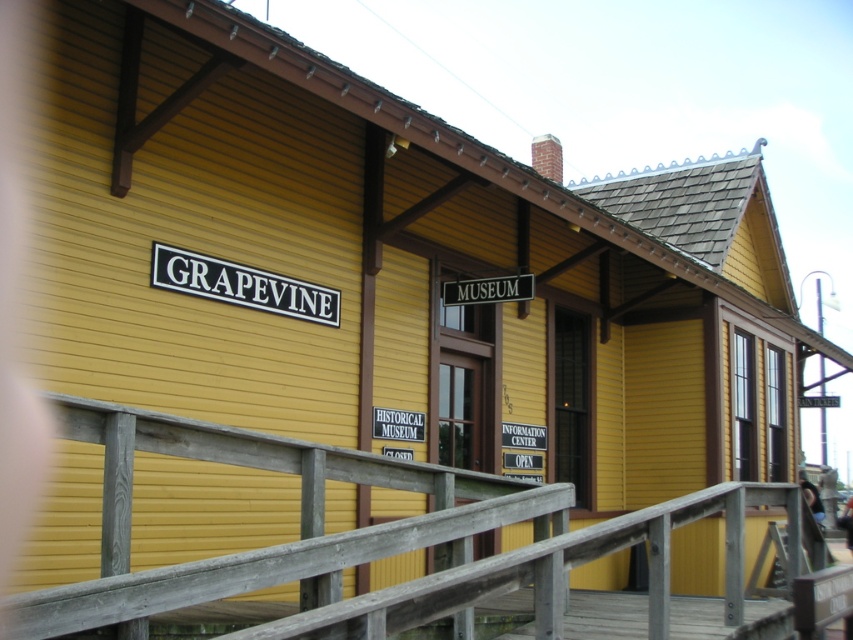
You are planning to hang a new rectangular plaque that is 2 feet wide on the front of the building. The plaque must be placed between the wooden at center and the black metal sign at center. Considering their widths, will there be enough space for the plaque between them?

The wooden at center has a larger width than the black metal sign at center. Since the plaque is 2 feet wide, it depends on the distance between them. However, the description only mentions their relative widths, not the spacing between them. Therefore, we cannot determine if there is enough space based on the given information.

You are a delivery person with a box that is 4 meters long. You need to move the box through the space between the wooden at center and the black metal sign at center. Can the box fit through that space? Please explain your reasoning.

The wooden at center and the black metal sign at center are 3.81 meters apart. Since the box is 4 meters long, which is longer than the available space, the box cannot fit through the space between them.